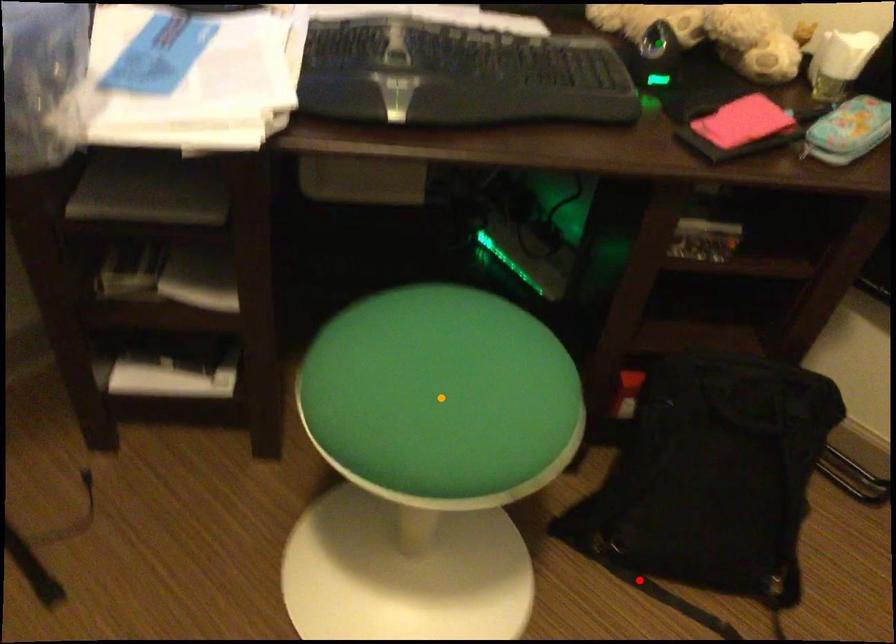
Looking at this image, order these from nearest to farthest:
1. orange point
2. red point
3. green point

red point < green point < orange point